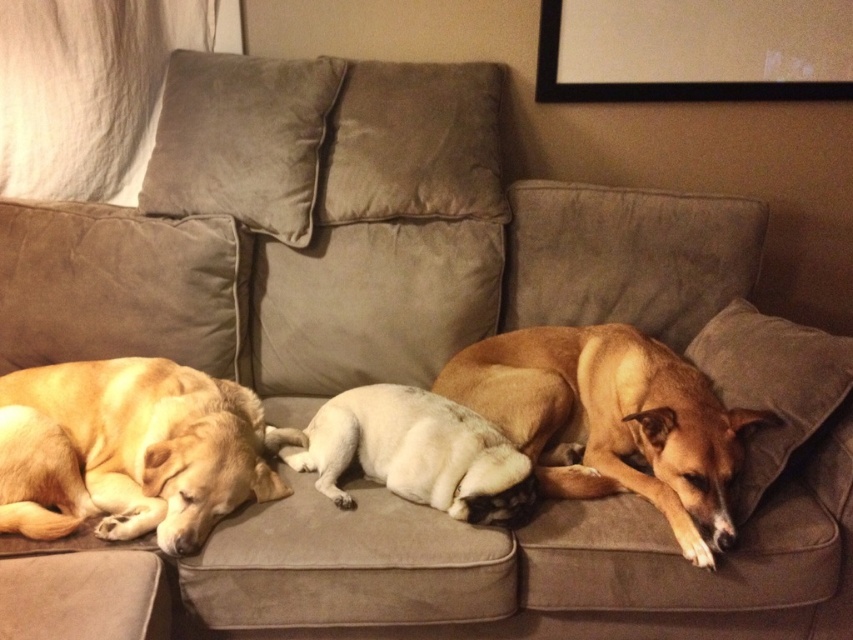
You are a dog owner who wants to place a new rectangular cushion between the golden fur dog at left and the brown smooth dog at center on the couch. Based on their sizes, which dog requires more space along the couch length?

The brown smooth dog at center requires more space along the couch length because it has a greater width than the golden fur dog at left.

You are a dog owner who wants to place a new toy between the brown smooth dog at center and the suede pillow at right. Based on their positions, where should you place the toy to ensure it is between them?

The toy should be placed between the brown smooth dog at center and the suede pillow at right, in the space where the brown smooth dog at center is positioned in front of the suede pillow at right.